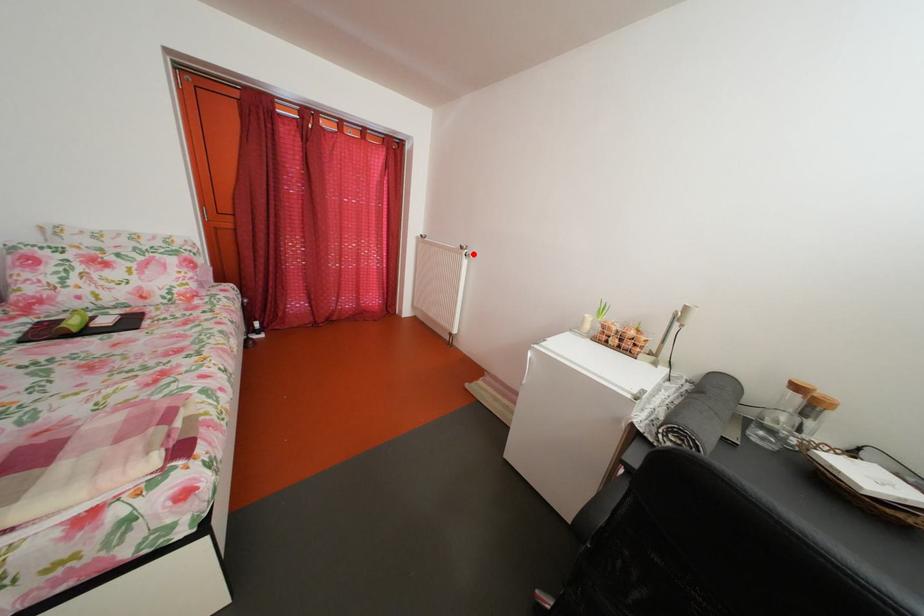
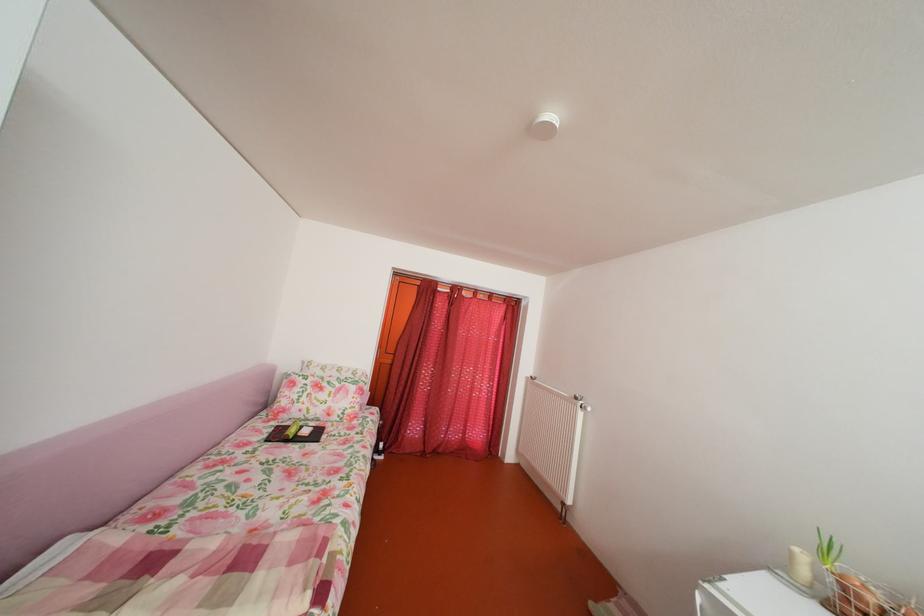
In the second image, find the point that corresponds to the highlighted location in the first image.

(588, 405)